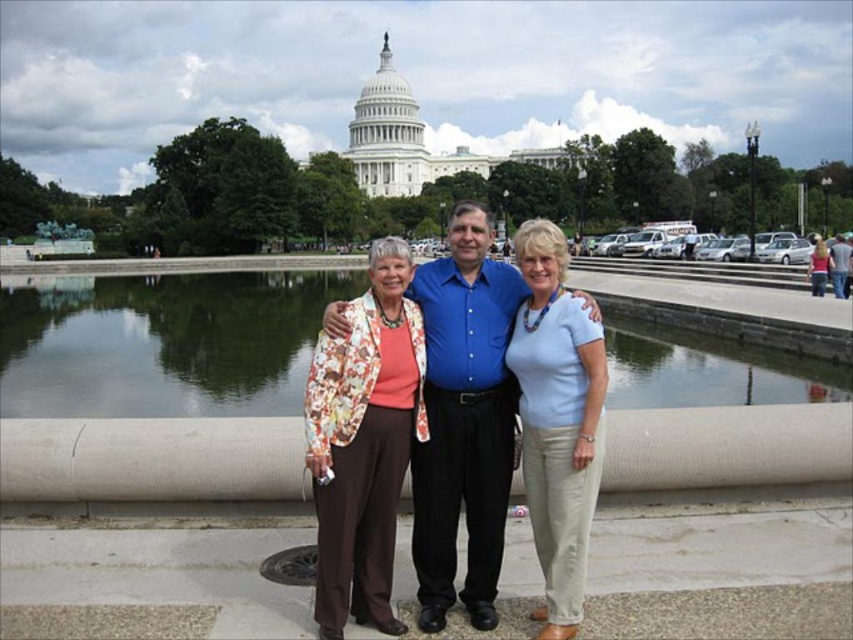
Can you confirm if transparent glass water at center is positioned below light blue cotton shirt at center?

Actually, transparent glass water at center is above light blue cotton shirt at center.

Can you confirm if transparent glass water at center is thinner than light blue cotton shirt at center?

In fact, transparent glass water at center might be wider than light blue cotton shirt at center.

Where is `transparent glass water at center`? transparent glass water at center is located at coordinates (161, 342).

Between floral-patterned fabric jacket at center and light blue cotton shirt at center, which one is positioned lower?

floral-patterned fabric jacket at center is lower down.

Is point (403, 333) farther from viewer compared to point (595, 499)?

Yes, it is.

Is point (354, 396) farther from camera compared to point (572, 486)?

Yes, point (354, 396) is farther from viewer.

Locate an element on the screen. This screenshot has width=853, height=640. floral-patterned fabric jacket at center is located at coordinates (363, 442).

Looking at this image, measure the distance between light blue cotton shirt at center and camera.

light blue cotton shirt at center is 189.38 feet away from camera.

Can you confirm if light blue cotton shirt at center is positioned above floral-patterned blouse at center?

No.

Is point (550, 452) behind point (814, 266)?

No.

Find the location of `light blue cotton shirt at center`. light blue cotton shirt at center is located at coordinates (556, 420).